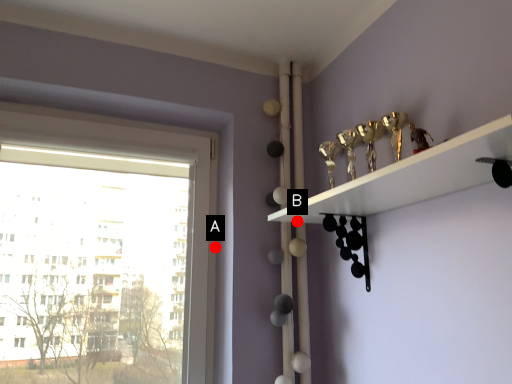
Question: Two points are circled on the image, labeled by A and B beside each circle. Which point is farther to the camera?

Choices:
 (A) A is further
 (B) B is further

Answer: (A)